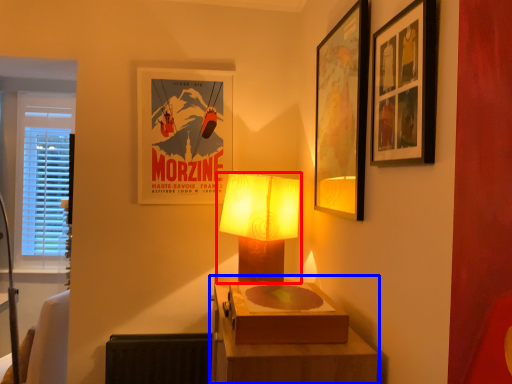
Question: Which of the following is the farthest to the observer, lamp (highlighted by a red box) or table (highlighted by a blue box)?

Choices:
 (A) lamp
 (B) table

Answer: (A)